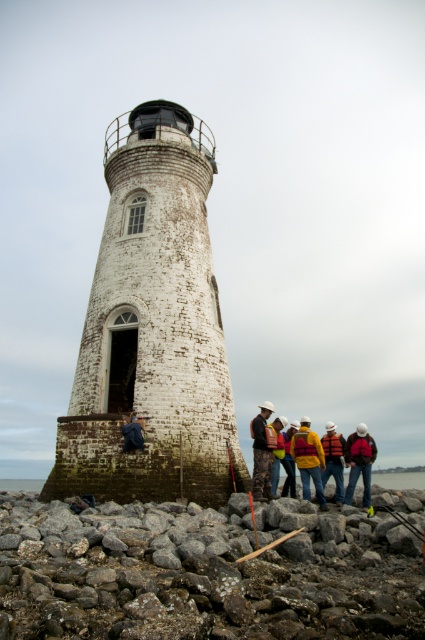
Can you confirm if gray rough stone at lower left is positioned above orange life vest at center?

Yes.

Who is shorter, gray rough stone at lower left or orange life vest at center?

With less height is gray rough stone at lower left.

Who is more forward, (6, 500) or (340, 440)?

Point (6, 500)

This screenshot has width=425, height=640. I want to click on gray rough stone at lower left, so click(201, 576).

Does gray rough stone at lower left have a smaller size compared to white stone tower at center?

Yes, gray rough stone at lower left is smaller than white stone tower at center.

Is gray rough stone at lower left above white stone tower at center?

No.

Image resolution: width=425 pixels, height=640 pixels. What do you see at coordinates (201, 576) in the screenshot? I see `gray rough stone at lower left` at bounding box center [201, 576].

Find the location of a particular element. The height and width of the screenshot is (640, 425). gray rough stone at lower left is located at coordinates (201, 576).

Which is above, red jacket at lower right or orange life vest at center?

orange life vest at center is above.

Is red jacket at lower right to the right of orange life vest at center from the viewer's perspective?

Yes, red jacket at lower right is to the right of orange life vest at center.

Is point (350, 456) behind point (342, 484)?

Yes, it is behind point (342, 484).

The image size is (425, 640). In order to click on red jacket at lower right in this screenshot , I will do `click(359, 461)`.